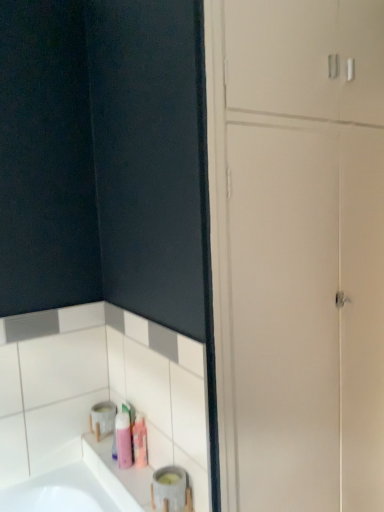
Question: Considering the positions of matte gray container at lower left and pink matte bottle at lower left, which is counted as the 1th toiletry, starting from the left, in the image, is matte gray container at lower left wider or thinner than pink matte bottle at lower left, which is counted as the 1th toiletry, starting from the left,?

Choices:
 (A) thin
 (B) wide

Answer: (B)

Question: Would you say matte gray container at lower left is inside or outside pink matte bottle at lower left, which appears as the 2th toiletry when viewed from the right?

Choices:
 (A) outside
 (B) inside

Answer: (A)

Question: Which is nearer to the white glossy dresser at lower left?

Choices:
 (A) pink matte toiletry at lower center, the second toiletry from the left
 (B) matte gray container at lower left
 (C) pink matte bottle at lower left, which is counted as the 1th toiletry, starting from the left

Answer: (B)

Question: Which object is positioned farthest from the pink matte bottle at lower left, which appears as the 2th toiletry when viewed from the right?

Choices:
 (A) matte gray container at lower left
 (B) pink matte toiletry at lower center, positioned as the first toiletry in right-to-left order
 (C) white glossy dresser at lower left

Answer: (C)